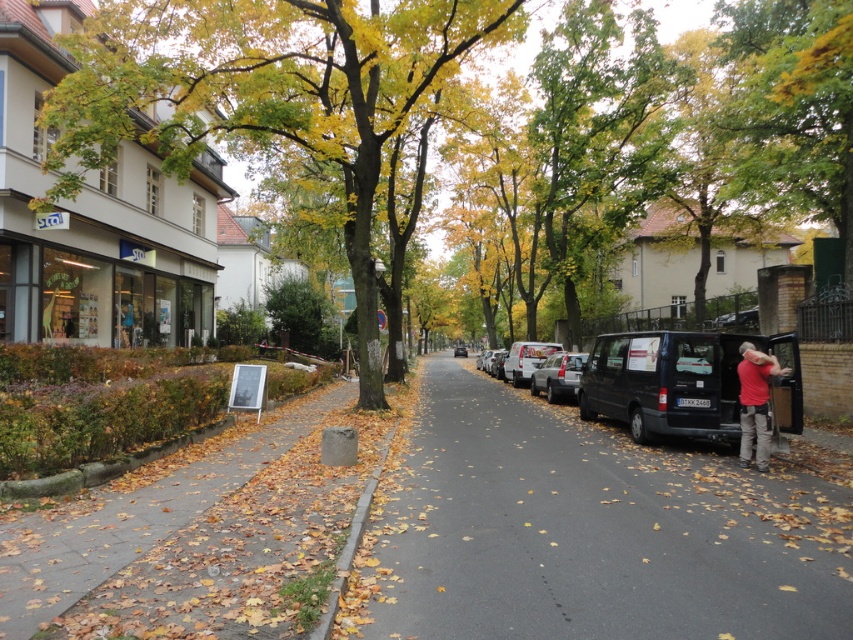
Does green leafy tree at left have a lesser height compared to white matte van at center?

Incorrect, green leafy tree at left's height does not fall short of white matte van at center's.

In the scene shown: Who is positioned more to the left, green leafy tree at left or white matte van at center?

green leafy tree at left is more to the left.

Find the location of a particular element. The image size is (853, 640). green leafy tree at left is located at coordinates (270, 93).

Which is below, red cotton shirt at lower right or satin silver car at center?

Positioned lower is satin silver car at center.

The height and width of the screenshot is (640, 853). Identify the location of red cotton shirt at lower right. (755, 403).

Identify the location of red cotton shirt at lower right. (755, 403).

Can you confirm if satin silver car at center is shorter than shiny black van at center?

Yes.

Who is more distant from viewer, (573, 369) or (462, 355)?

Point (462, 355)

Which is in front, point (566, 369) or point (456, 346)?

Point (566, 369) is more forward.

Locate an element on the screen. This screenshot has width=853, height=640. satin silver car at center is located at coordinates (556, 376).